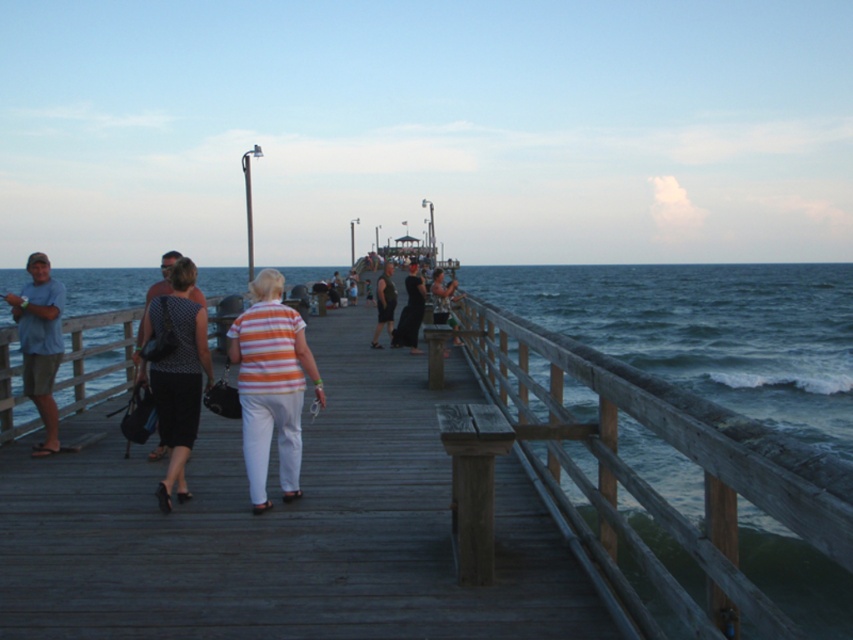
In the scene shown: Does dark gray fabric shirt at center have a lesser width compared to matte black dress at center?

Yes.

Who is more distant from viewer, (x=386, y=268) or (x=444, y=300)?

The point (x=444, y=300) is more distant.

Identify the location of dark gray fabric shirt at center. (384, 304).

Which is more to the right, wooden dock at center or black dress at center?

From the viewer's perspective, wooden dock at center appears more on the right side.

This screenshot has width=853, height=640. What do you see at coordinates (711, 332) in the screenshot?
I see `wooden dock at center` at bounding box center [711, 332].

Where is `wooden dock at center`? The height and width of the screenshot is (640, 853). wooden dock at center is located at coordinates (711, 332).

Is wooden dock at center to the right of matte blue shirt at left from the viewer's perspective?

Correct, you'll find wooden dock at center to the right of matte blue shirt at left.

The height and width of the screenshot is (640, 853). What do you see at coordinates (711, 332) in the screenshot? I see `wooden dock at center` at bounding box center [711, 332].

You are a GUI agent. You are given a task and a screenshot of the screen. Output one action in this format:
    pyautogui.click(x=<x>, y=<y>)
    Task: Click on the wooden dock at center
    
    Given the screenshot: What is the action you would take?
    pyautogui.click(x=711, y=332)